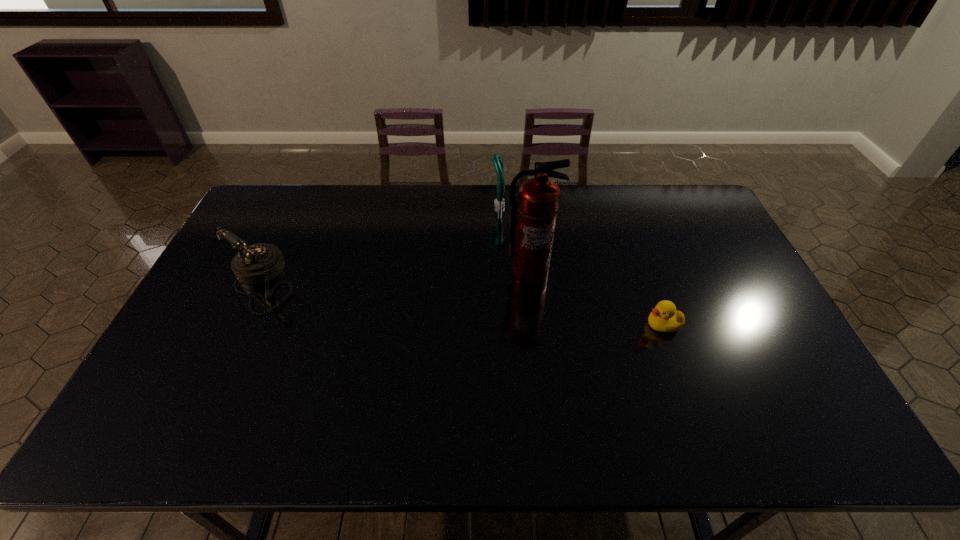
Where is `blank region between the farthest object and the rightmost object`? blank region between the farthest object and the rightmost object is located at coordinates (580, 265).

At what (x,y) coordinates should I click in order to perform the action: click on object that ranks as the second closest to the fire extinguisher. Please return your answer as a coordinate pair (x, y). This screenshot has height=540, width=960. Looking at the image, I should click on click(x=664, y=318).

At what (x,y) coordinates should I click in order to perform the action: click on object that is the third closest to the duck. Please return your answer as a coordinate pair (x, y). This screenshot has height=540, width=960. Looking at the image, I should click on (258, 263).